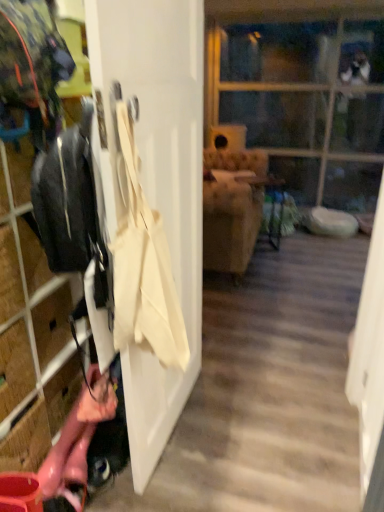
Question: Is transparent plastic screen door at right smaller than transparent glass door at upper center?

Choices:
 (A) no
 (B) yes

Answer: (B)

Question: Can you confirm if transparent plastic screen door at right is bigger than transparent glass door at upper center?

Choices:
 (A) no
 (B) yes

Answer: (A)

Question: Is transparent plastic screen door at right not inside transparent glass door at upper center?

Choices:
 (A) no
 (B) yes

Answer: (B)

Question: From a real-world perspective, is transparent plastic screen door at right positioned under transparent glass door at upper center based on gravity?

Choices:
 (A) no
 (B) yes

Answer: (B)

Question: Is transparent plastic screen door at right in front of transparent glass door at upper center?

Choices:
 (A) no
 (B) yes

Answer: (B)

Question: Does transparent plastic screen door at right have a lesser width compared to transparent glass door at upper center?

Choices:
 (A) no
 (B) yes

Answer: (B)

Question: Is beige canvas tote at left outside of matte black jacket at left?

Choices:
 (A) yes
 (B) no

Answer: (A)

Question: Considering the relative sizes of beige canvas tote at left and matte black jacket at left in the image provided, is beige canvas tote at left thinner than matte black jacket at left?

Choices:
 (A) no
 (B) yes

Answer: (B)

Question: Is beige canvas tote at left wider than matte black jacket at left?

Choices:
 (A) no
 (B) yes

Answer: (A)

Question: From a real-world perspective, is beige canvas tote at left below matte black jacket at left?

Choices:
 (A) yes
 (B) no

Answer: (B)

Question: Is beige canvas tote at left to the left of matte black jacket at left from the viewer's perspective?

Choices:
 (A) no
 (B) yes

Answer: (A)

Question: Is beige canvas tote at left further to camera compared to matte black jacket at left?

Choices:
 (A) no
 (B) yes

Answer: (A)

Question: Considering the relative sizes of beige canvas tote at left and white matte door at center in the image provided, is beige canvas tote at left shorter than white matte door at center?

Choices:
 (A) no
 (B) yes

Answer: (B)